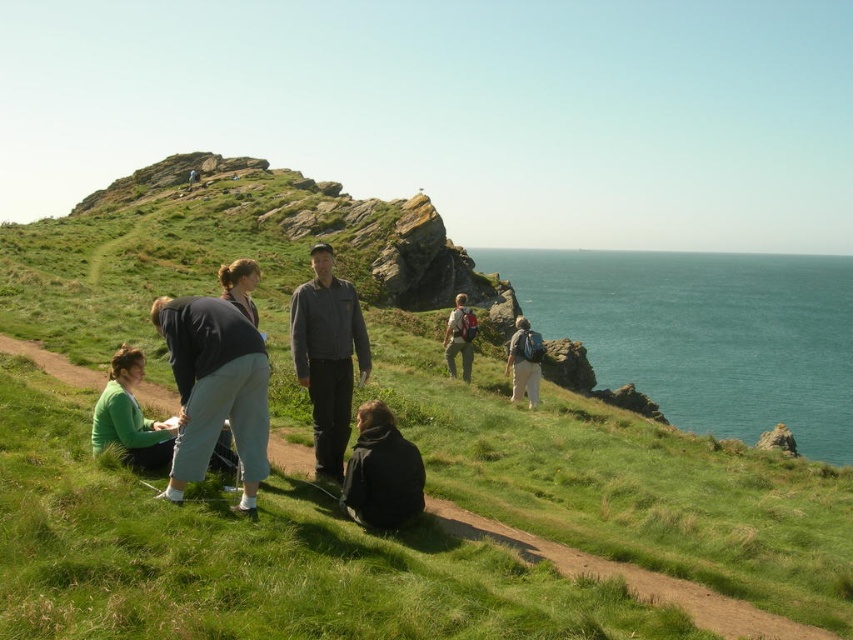
You are standing at the center of the grassy hillside and want to retrieve your green sweater at lower left. Which direction should you move to reach it?

You should move towards the lower left direction to reach the green sweater at lower left, as it is located at point (131, 417).

You are standing on the grassy hillside and want to hand a map to the person wearing the dark brown jacket at lower center and the dark blue jacket at center. Which jacket is closer to you so you can reach it first?

The dark brown jacket at lower center is closer to the viewer than the dark blue jacket at center, so you can reach it first.